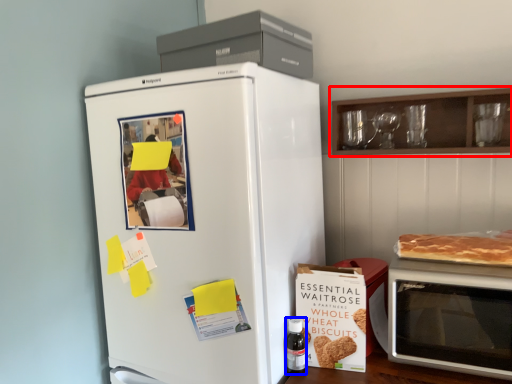
Question: Which point is closer to the camera, cabinetry (highlighted by a red box) or bottle (highlighted by a blue box)?

Choices:
 (A) cabinetry
 (B) bottle

Answer: (A)